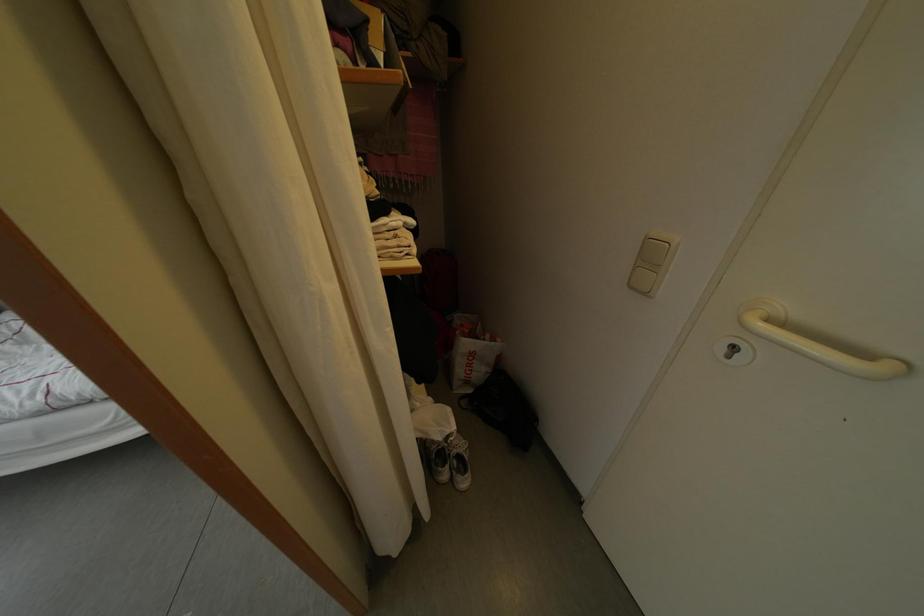
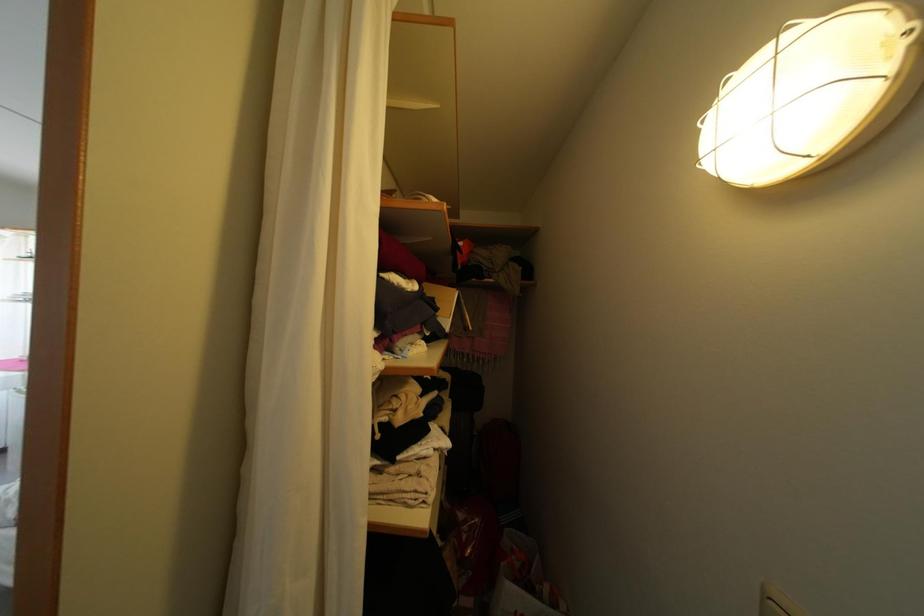
How did the camera likely rotate?

The camera rotated toward left-up.